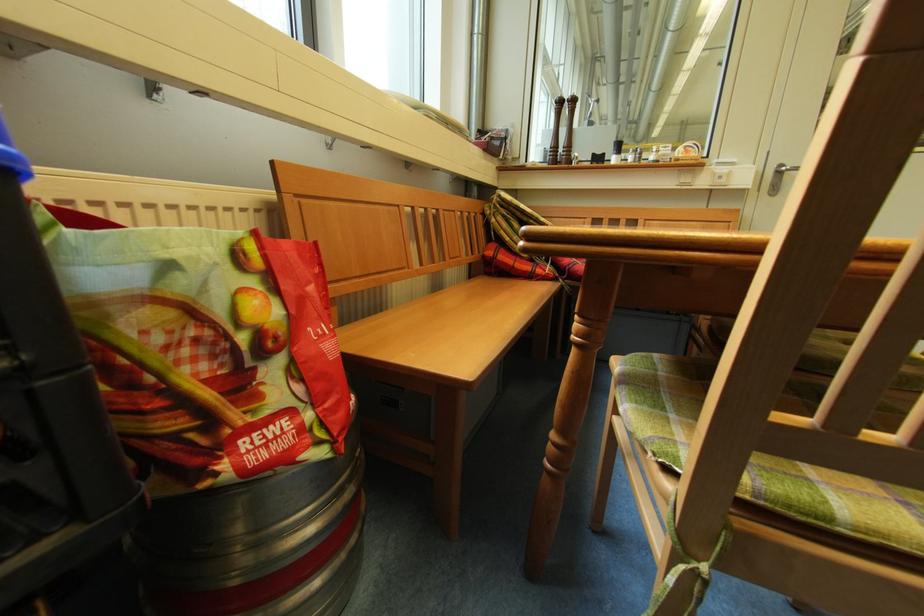
Image resolution: width=924 pixels, height=616 pixels. Find the location of `chair sitting surface`. chair sitting surface is located at coordinates (661, 405).